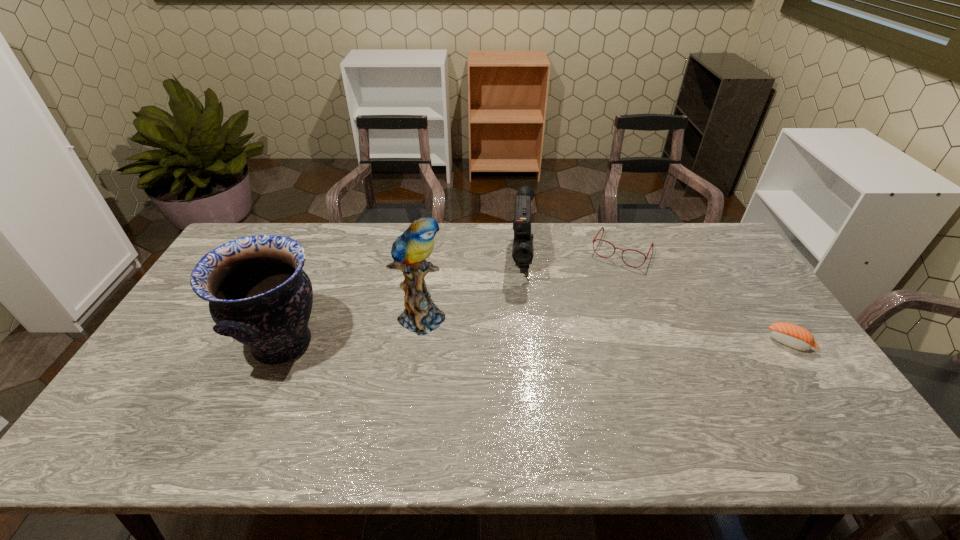
Identify the location of free space located 0.110m on the front handle of the pottery. The height and width of the screenshot is (540, 960). (198, 344).

This screenshot has height=540, width=960. I want to click on free space located on the front handle of the pottery, so click(169, 344).

This screenshot has height=540, width=960. I want to click on vacant region located on the front handle of the pottery, so click(x=162, y=344).

At what (x,y) coordinates should I click in order to perform the action: click on vacant area situated 0.130m on the front of the sushi. Please return your answer as a coordinate pair (x, y). Looking at the image, I should click on (826, 395).

Where is `vacant space located 0.230m on the face of the tallest object`? This screenshot has height=540, width=960. vacant space located 0.230m on the face of the tallest object is located at coordinates (513, 359).

At what (x,y) coordinates should I click in order to perform the action: click on vacant space located on the face of the tallest object. Please return your answer as a coordinate pair (x, y). The height and width of the screenshot is (540, 960). Looking at the image, I should click on (533, 369).

Find the location of a particular element. vacant area situated 0.200m on the face of the tallest object is located at coordinates (503, 355).

This screenshot has height=540, width=960. Find the location of `vacant space located 0.340m on the face of the spectacles`. vacant space located 0.340m on the face of the spectacles is located at coordinates (574, 334).

Locate an element on the screen. The height and width of the screenshot is (540, 960). vacant region located on the face of the spectacles is located at coordinates (588, 308).

At what (x,y) coordinates should I click in order to perform the action: click on vacant area located 0.300m on the face of the spectacles. Please return your answer as a coordinate pair (x, y). Looking at the image, I should click on (579, 325).